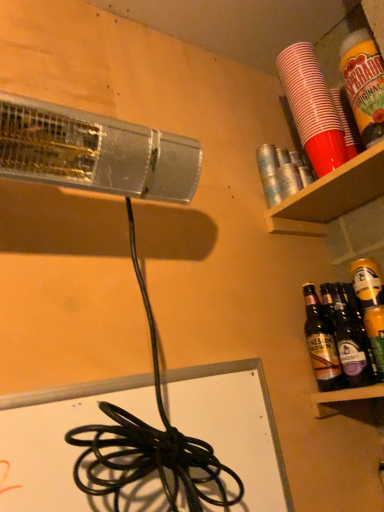
Question: Is brown glass bottles at right, the 2th bottle when ordered from right to left, outside of dark brown glass bottle at lower right, the first bottle from the right?

Choices:
 (A) yes
 (B) no

Answer: (A)

Question: Considering the relative positions of brown glass bottles at right, the 2th bottle when ordered from right to left, and dark brown glass bottle at lower right, the first bottle from the right, in the image provided, is brown glass bottles at right, the 2th bottle when ordered from right to left, behind dark brown glass bottle at lower right, the first bottle from the right,?

Choices:
 (A) no
 (B) yes

Answer: (B)

Question: Considering the relative positions of brown glass bottles at right, arranged as the first bottle when viewed from the left, and dark brown glass bottle at lower right, the first bottle from the right, in the image provided, is brown glass bottles at right, arranged as the first bottle when viewed from the left, to the left of dark brown glass bottle at lower right, the first bottle from the right, from the viewer's perspective?

Choices:
 (A) yes
 (B) no

Answer: (A)

Question: Is brown glass bottles at right, the 2th bottle when ordered from right to left, touching dark brown glass bottle at lower right, the 2th bottle in the left-to-right sequence?

Choices:
 (A) yes
 (B) no

Answer: (A)

Question: From a real-world perspective, does brown glass bottles at right, the 2th bottle when ordered from right to left, sit lower than dark brown glass bottle at lower right, the first bottle from the right?

Choices:
 (A) yes
 (B) no

Answer: (B)

Question: Would you say dark brown glass bottle at lower right, the 2th bottle in the left-to-right sequence, is inside or outside gold matte can at right?

Choices:
 (A) outside
 (B) inside

Answer: (A)

Question: From their relative heights in the image, would you say dark brown glass bottle at lower right, the 2th bottle in the left-to-right sequence, is taller or shorter than gold matte can at right?

Choices:
 (A) short
 (B) tall

Answer: (B)

Question: Considering the positions of dark brown glass bottle at lower right, the first bottle from the right, and gold matte can at right in the image, is dark brown glass bottle at lower right, the first bottle from the right, wider or thinner than gold matte can at right?

Choices:
 (A) wide
 (B) thin

Answer: (A)

Question: Looking at the image, does dark brown glass bottle at lower right, the first bottle from the right, seem bigger or smaller compared to gold matte can at right?

Choices:
 (A) big
 (B) small

Answer: (A)

Question: From a real-world perspective, is brown glass bottles at right, the 2th bottle when ordered from right to left, above or below orange plastic cup at upper right, the second beverage positioned from the back?

Choices:
 (A) below
 (B) above

Answer: (A)

Question: Considering the positions of point (309, 323) and point (367, 46), is point (309, 323) closer or farther from the camera than point (367, 46)?

Choices:
 (A) farther
 (B) closer

Answer: (A)

Question: Is brown glass bottles at right, the 2th bottle when ordered from right to left, spatially inside orange plastic cup at upper right, which is counted as the 1th beverage, starting from the front, or outside of it?

Choices:
 (A) outside
 (B) inside

Answer: (A)

Question: Considering the positions of brown glass bottles at right, arranged as the first bottle when viewed from the left, and orange plastic cup at upper right, the second beverage positioned from the back, in the image, is brown glass bottles at right, arranged as the first bottle when viewed from the left, taller or shorter than orange plastic cup at upper right, the second beverage positioned from the back,?

Choices:
 (A) tall
 (B) short

Answer: (B)

Question: Looking at the image, does gold matte can at right seem bigger or smaller compared to dark brown glass bottle at lower right, the 2th bottle in the left-to-right sequence?

Choices:
 (A) small
 (B) big

Answer: (A)

Question: Does point (365, 298) appear closer or farther from the camera than point (347, 321)?

Choices:
 (A) farther
 (B) closer

Answer: (B)